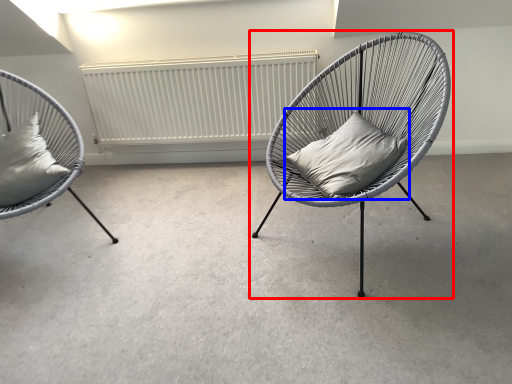
Question: Which object is further to the camera taking this photo, chair (highlighted by a red box) or pillow (highlighted by a blue box)?

Choices:
 (A) chair
 (B) pillow

Answer: (B)